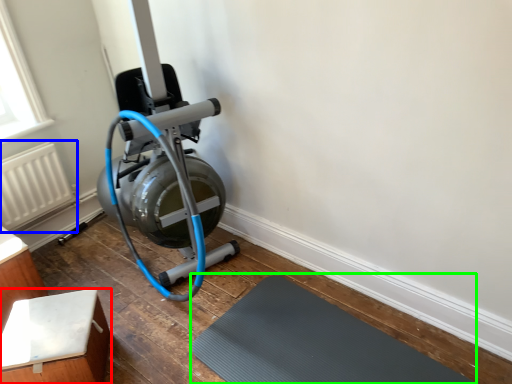
Question: Considering the real-world distances, which object is farthest from furniture (highlighted by a red box)? radiator (highlighted by a blue box) or bath mat (highlighted by a green box)?

Choices:
 (A) radiator
 (B) bath mat

Answer: (A)